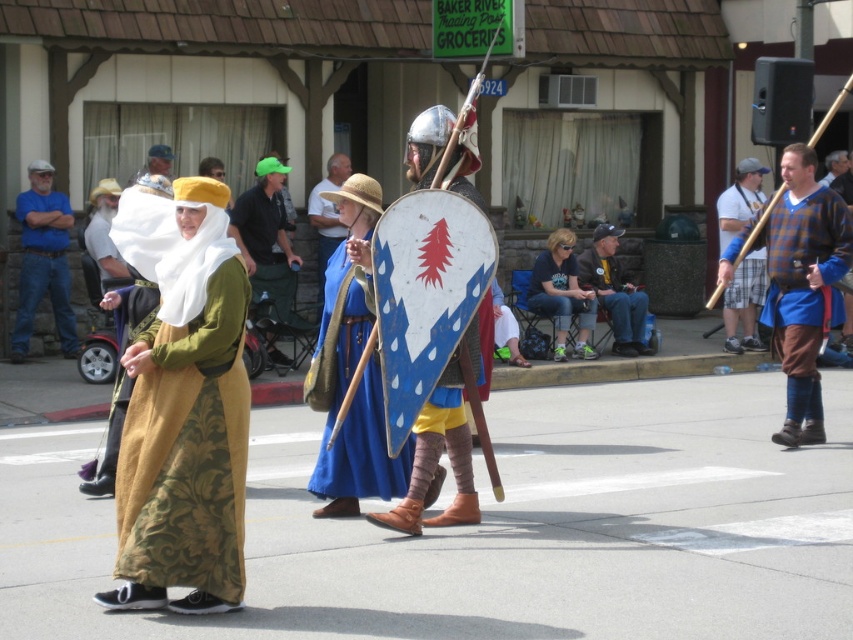
You are a photographer standing at the camera position. You want to capture a closeup shot of the matte gold fabric dress at center. Given that your camera can focus on objects within 10 feet, will you be able to take the closeup?

The matte gold fabric dress at center is 24.88 feet from the camera, which is beyond the camera focus range of 10 feet. Therefore, you cannot take a closeup shot.

You are a photographer trying to capture a photo of both the blue denim jeans at left and the matte gold helmet at center. Since you want both to be clearly visible in the frame, which object should you focus on to ensure the taller one is in focus?

The blue denim jeans at left is much taller than the matte gold helmet at center, so you should focus on the blue denim jeans at left to ensure the taller object is in focus.